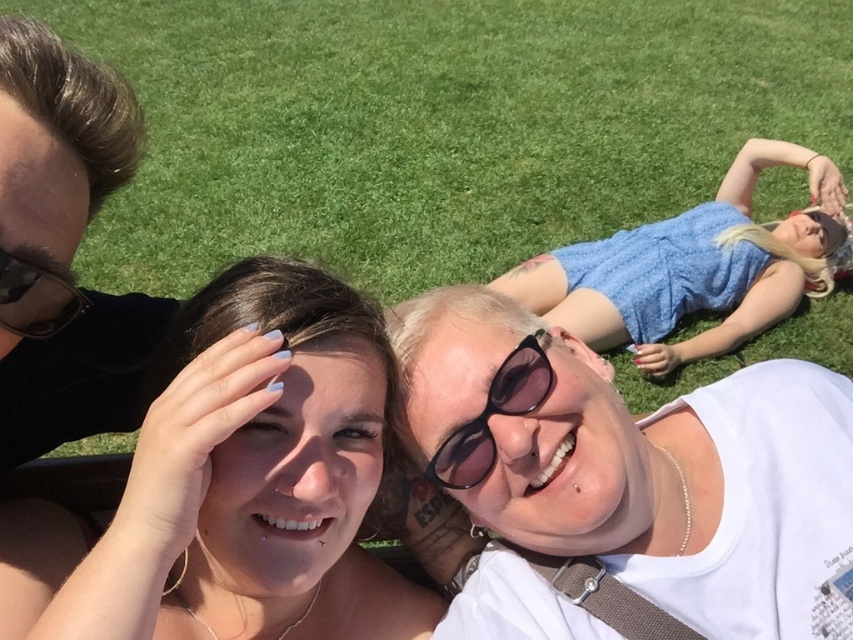
You are a photographer trying to capture a closeup of the smooth skin face at center and the black plastic sunglasses at center. Since you can only focus on one object at a time, which one should you focus on first if you want to ensure both are in focus without moving the camera?

The smooth skin face at center is to the left of black plastic sunglasses at center. Since they are positioned side by side, focusing on the smooth skin face at center first would allow the photographer to adjust the focus to include the black plastic sunglasses at center in the same plane without moving the camera.

Based on the scene description, where exactly is the green grass at upper center located in terms of coordinates?

The green grass at upper center is located at point coordinates of 0.198 on the x axis and 0.515 on the y axis.